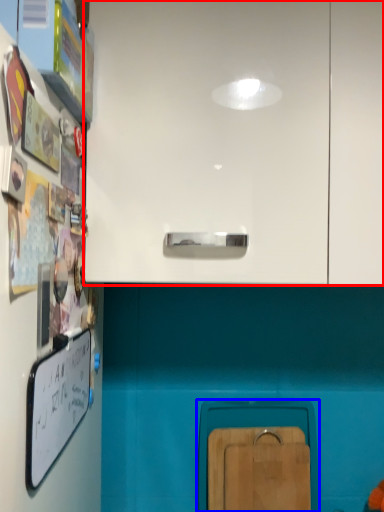
Question: Which of the following is the farthest to the observer, cabinetry (highlighted by a red box) or cabinetry (highlighted by a blue box)?

Choices:
 (A) cabinetry
 (B) cabinetry

Answer: (B)